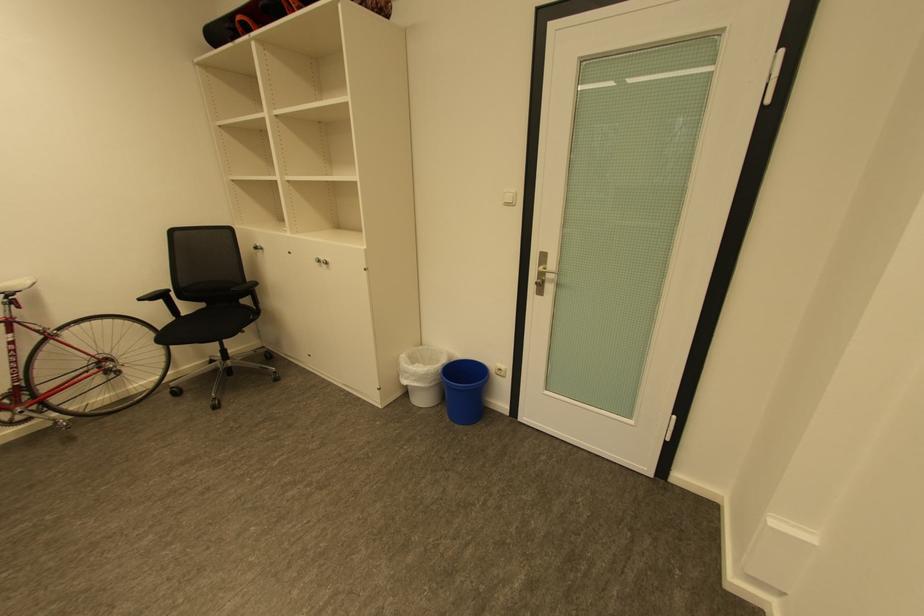
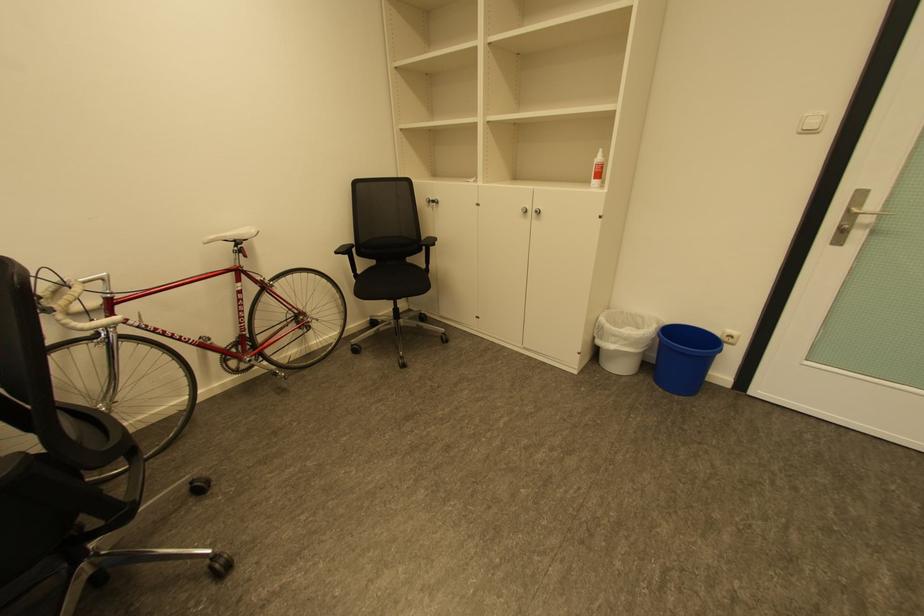
Locate, in the second image, the point that corresponds to point 209,306 in the first image.

(380, 262)